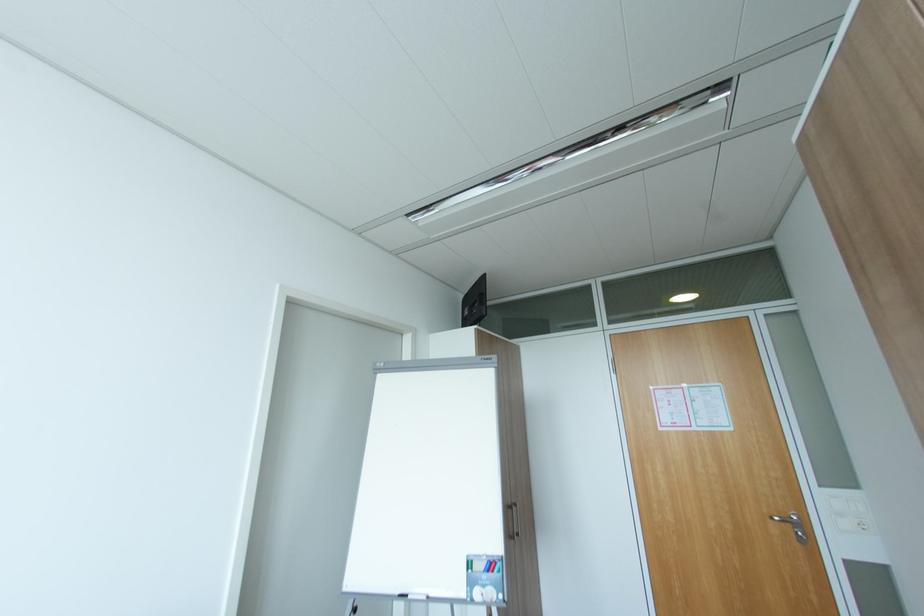
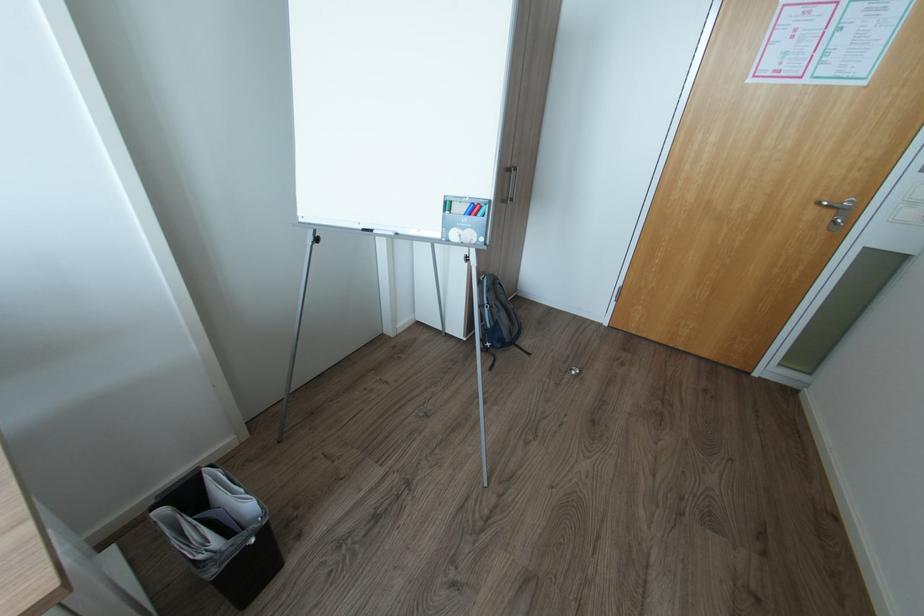
Where in the second image is the point corresponding to (806,533) from the first image?

(845, 221)